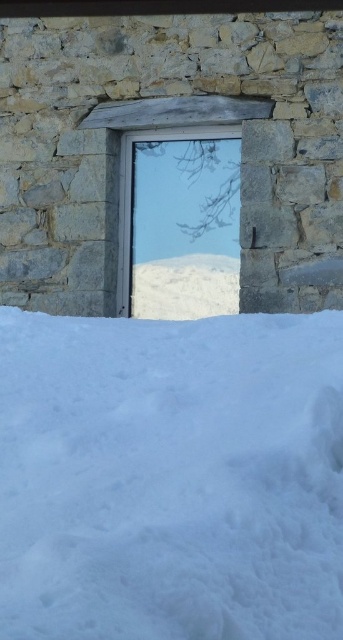
You are an architect designing a new building and want to incorporate elements from this rustic stone structure. You have a small statue that is 1 meter tall. If you place it on the white fluffy snow at lower center, will it be taller than the transparent glass window at center?

The white fluffy snow at lower center is bigger than the transparent glass window at center, but the question is about the statue placed on the snow. Since the statue is 1 meter tall, it would be taller than the transparent glass window at center only if the window is shorter than 1 meter. However, the provided information does not specify the height of the window, so we cannot determine this.

You are standing in front of a rustic stone wall with a snowy view. You want to place a small snowman exactly 2 meters away from where you are standing. Can you build the snowman on the white fluffy snow at lower center?

The white fluffy snow at lower center is only 1.82 meters away from the camera, so placing a snowman exactly 2 meters away would require moving slightly further back from the white fluffy snow at lower center.

You are a snowplow operator trying to clear the snow from the area. You need to know if the snowplow can safely move from the white fluffy snow at lower center to the transparent glass window at center without getting stuck. The snowplow requires at least 10 feet of clearance. Can it make the move?

The distance between the white fluffy snow at lower center and the transparent glass window at center is 9.66 feet, which is less than the required 10 feet clearance. Therefore, the snowplow cannot safely move without getting stuck.